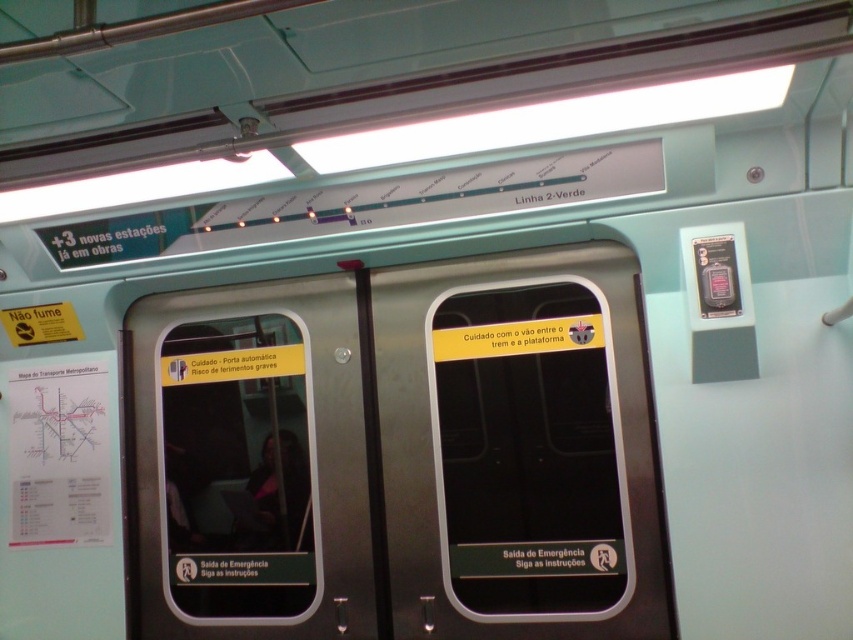
Find the location of a particular element. This screenshot has width=853, height=640. metallic silver emergency exit door at center is located at coordinates click(x=521, y=451).

Does metallic silver emergency exit door at center have a larger size compared to metallic silver door at center?

Indeed, metallic silver emergency exit door at center has a larger size compared to metallic silver door at center.

Is point (648, 608) positioned in front of point (178, 314)?

Yes, it is in front of point (178, 314).

I want to click on metallic silver emergency exit door at center, so click(x=521, y=451).